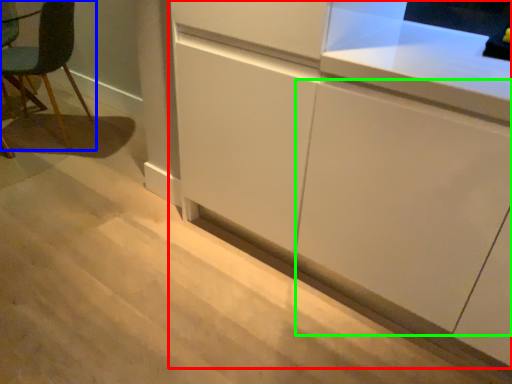
Question: Based on their relative distances, which object is farther from cabinetry (highlighted by a red box)? Choose from chair (highlighted by a blue box) and cabinetry (highlighted by a green box).

Choices:
 (A) chair
 (B) cabinetry

Answer: (A)